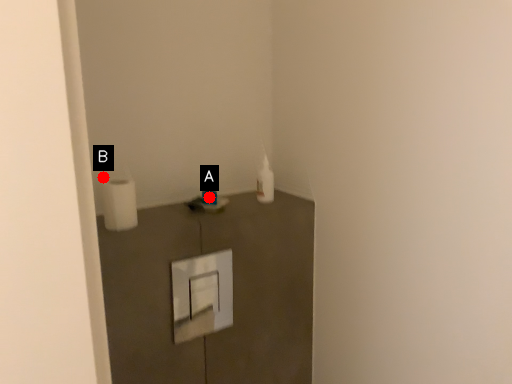
Question: Two points are circled on the image, labeled by A and B beside each circle. Which point appears closest to the camera in this image?

Choices:
 (A) A is closer
 (B) B is closer

Answer: (B)